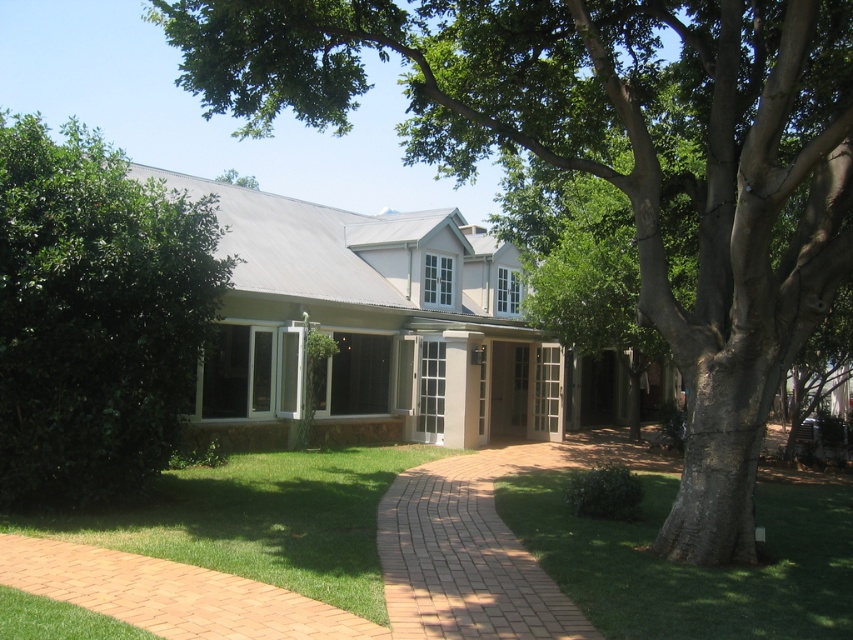
Does green leafy hedge at left lie behind brick at center?

That is True.

Which is more to the right, green leafy hedge at left or brick at center?

From the viewer's perspective, brick at center appears more on the right side.

Identify the location of green leafy hedge at left. The width and height of the screenshot is (853, 640). (96, 314).

Is point (822, 307) farther from viewer compared to point (491, 564)?

No, (822, 307) is closer to viewer.

Between point (715, 324) and point (509, 456), which one is positioned in front?

Positioned in front is point (715, 324).

In order to click on green rough bark tree at center in this screenshot , I will do `click(610, 163)`.

Is green grass at lower left above brick at center?

Correct, green grass at lower left is located above brick at center.

Who is positioned more to the left, green grass at lower left or brick at center?

green grass at lower left

Which is in front, point (154, 532) or point (473, 474)?

Point (154, 532)

Locate an element on the screen. The width and height of the screenshot is (853, 640). green grass at lower left is located at coordinates (259, 520).